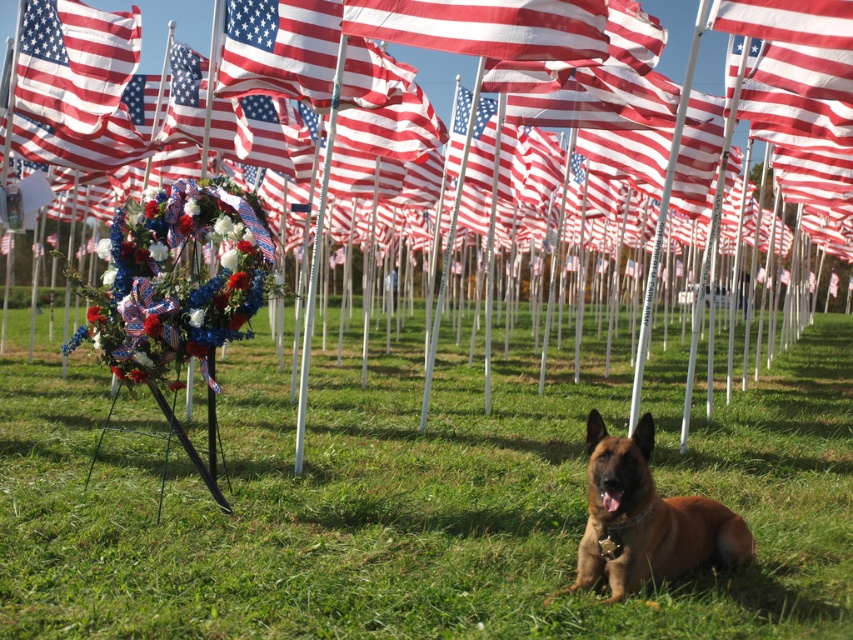
Who is positioned more to the right, red-white-striped flag at center or red-white-and-blue fabric flag at center?

red-white-striped flag at center

Is red-white-striped flag at center below red-white-and-blue fabric flag at center?

No.

Identify the location of red-white-striped flag at center. This screenshot has width=853, height=640. (280, 49).

At what (x,y) coordinates should I click in order to perform the action: click on red-white-striped flag at center. Please return your answer as a coordinate pair (x, y). This screenshot has height=640, width=853. Looking at the image, I should click on (280, 49).

Looking at this image, who is taller, brown fur dog at lower right or red-white-striped flag at center?

red-white-striped flag at center

How distant is brown fur dog at lower right from red-white-striped flag at center?

brown fur dog at lower right and red-white-striped flag at center are 4.65 meters apart.

At what (x,y) coordinates should I click in order to perform the action: click on brown fur dog at lower right. Please return your answer as a coordinate pair (x, y). The height and width of the screenshot is (640, 853). Looking at the image, I should click on (645, 518).

This screenshot has width=853, height=640. I want to click on brown fur dog at lower right, so click(645, 518).

Can you confirm if red-white-striped flag at center is bigger than matte fabric flag at upper left?

Yes.

Does point (251, 60) lie in front of point (97, 74)?

Yes.

Between point (222, 90) and point (77, 81), which one is positioned behind?

Positioned behind is point (77, 81).

Find the location of a particular element. Image resolution: width=853 pixels, height=640 pixels. red-white-striped flag at center is located at coordinates (280, 49).